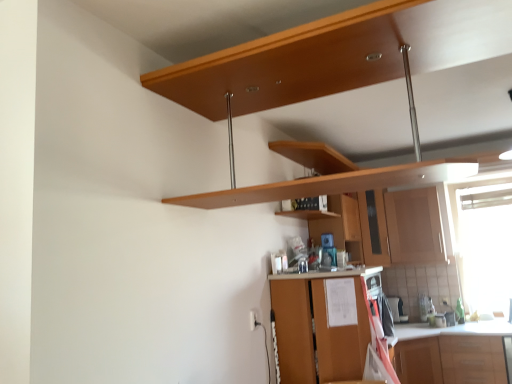
Question: From the image's perspective, is wooden shelf at center below wooden cabinet at center, which is counted as the third cabinetry, starting from the front?

Choices:
 (A) yes
 (B) no

Answer: (B)

Question: Is wooden shelf at center in contact with wooden cabinet at center, which is counted as the first cabinetry, starting from the back?

Choices:
 (A) yes
 (B) no

Answer: (B)

Question: From a real-world perspective, is wooden shelf at center located higher than wooden cabinet at center, which is counted as the third cabinetry, starting from the front?

Choices:
 (A) no
 (B) yes

Answer: (A)

Question: Considering the relative sizes of wooden shelf at center and wooden cabinet at center, which is counted as the first cabinetry, starting from the back, in the image provided, is wooden shelf at center bigger than wooden cabinet at center, which is counted as the first cabinetry, starting from the back,?

Choices:
 (A) no
 (B) yes

Answer: (A)

Question: From the image's perspective, would you say wooden shelf at center is positioned over wooden cabinet at center, which is counted as the first cabinetry, starting from the back?

Choices:
 (A) yes
 (B) no

Answer: (A)

Question: Considering the positions of point (396, 301) and point (253, 316), is point (396, 301) closer or farther from the camera than point (253, 316)?

Choices:
 (A) farther
 (B) closer

Answer: (A)

Question: From a real-world perspective, is satin black coffee maker at lower right positioned above or below white glossy electric outlet at lower center?

Choices:
 (A) above
 (B) below

Answer: (B)

Question: Is satin black coffee maker at lower right spatially inside white glossy electric outlet at lower center, or outside of it?

Choices:
 (A) inside
 (B) outside

Answer: (B)

Question: From the image's perspective, is satin black coffee maker at lower right above or below white glossy electric outlet at lower center?

Choices:
 (A) above
 (B) below

Answer: (B)

Question: From a real-world perspective, relative to white glossy electric outlet at lower center, is transparent plastic window screen at right vertically above or below?

Choices:
 (A) above
 (B) below

Answer: (A)

Question: In terms of width, does transparent plastic window screen at right look wider or thinner when compared to white glossy electric outlet at lower center?

Choices:
 (A) wide
 (B) thin

Answer: (A)

Question: Is transparent plastic window screen at right taller or shorter than white glossy electric outlet at lower center?

Choices:
 (A) tall
 (B) short

Answer: (A)

Question: Which is correct: transparent plastic window screen at right is inside white glossy electric outlet at lower center, or outside of it?

Choices:
 (A) outside
 (B) inside

Answer: (A)

Question: In terms of size, does wooden shelf at center appear bigger or smaller than wooden cabinet at center, which is counted as the third cabinetry, starting from the front?

Choices:
 (A) small
 (B) big

Answer: (A)

Question: In the image, is wooden shelf at center on the left side or the right side of wooden cabinet at center, which is counted as the third cabinetry, starting from the front?

Choices:
 (A) right
 (B) left

Answer: (B)